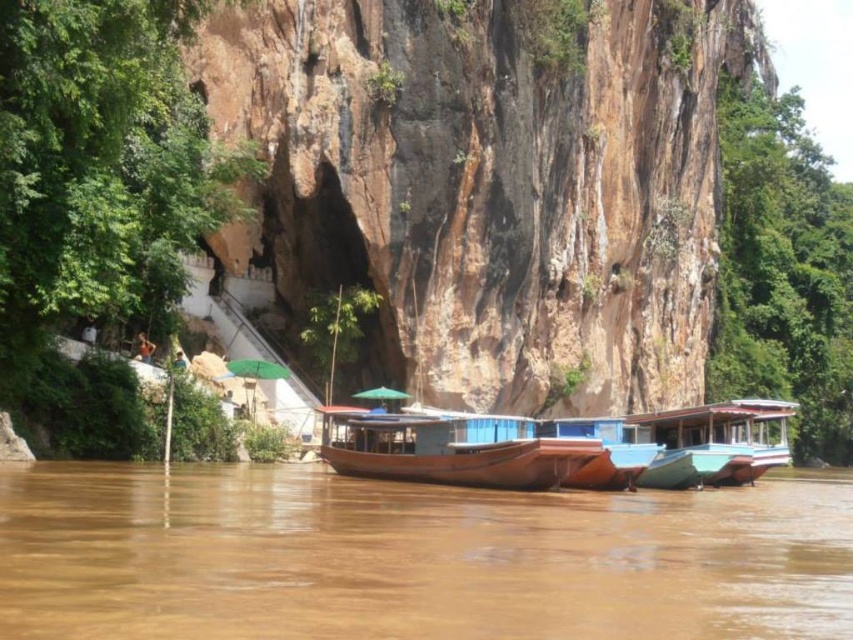
Question: Among these points, which one is farthest from the camera?

Choices:
 (A) (283, 506)
 (B) (550, 205)

Answer: (B)

Question: Is brown rock cliff at center closer to camera compared to brown wooden boats at center?

Choices:
 (A) no
 (B) yes

Answer: (A)

Question: Is brown rock cliff at center positioned before brown wooden boats at center?

Choices:
 (A) no
 (B) yes

Answer: (A)

Question: Which of the following is the farthest from the observer?

Choices:
 (A) (173, 500)
 (B) (482, 115)

Answer: (B)

Question: Considering the relative positions of brown rock cliff at center and brown wooden boats at center in the image provided, where is brown rock cliff at center located with respect to brown wooden boats at center?

Choices:
 (A) left
 (B) right

Answer: (B)